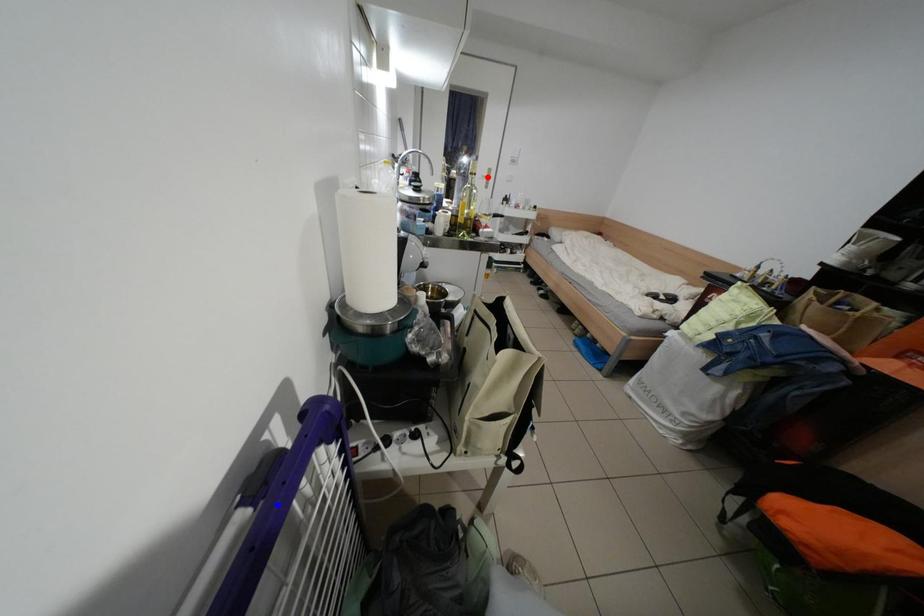
Question: Which of the two points in the image is closer to the camera?

Choices:
 (A) Blue point is closer.
 (B) Red point is closer.

Answer: (A)